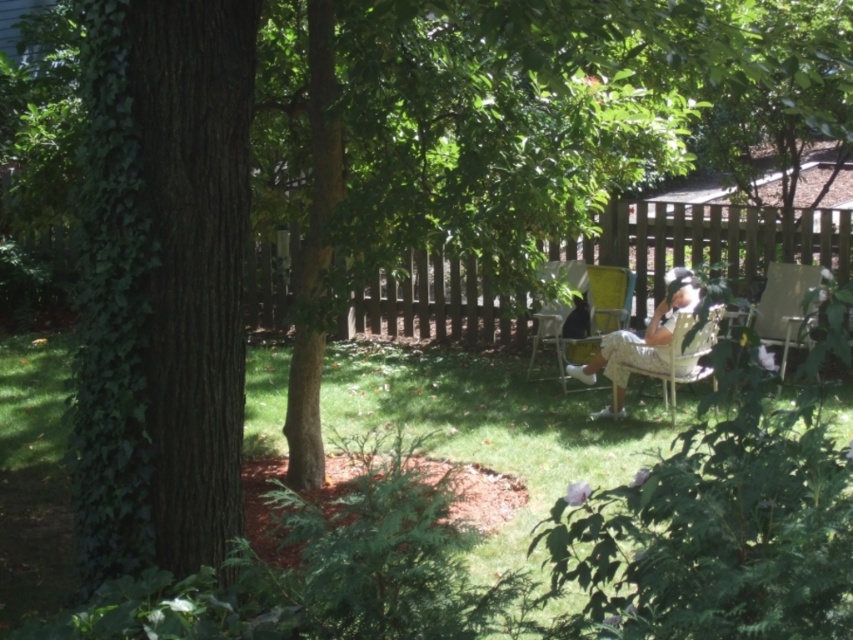
You are standing in the backyard and want to place a small potted plant exactly at the point labeled as point (102, 115). If you are currently 11.66 feet away from this point, how many steps do you need to take to reach it, assuming each step covers approximately 2.5 feet?

Since you are 11.66 feet away from point (102, 115) and each step covers about 2.5 feet, dividing 11.66 by 2.5 gives approximately 4.66 steps. Therefore, you would need to take around 5 steps to reach the point.

You are standing in the backyard and want to place a 30 feet long ladder against the brown wooden fence at center. Can you fit the ladder horizontally without it extending beyond the fence?

The brown wooden fence at center is 30.69 feet away from the viewer. Since the ladder is only 30 feet long, it can be placed horizontally against the fence without extending beyond it as the distance is slightly more than the ladder length.

You are planning to place a new bench in the backyard that is 1 meter wide. You see the brown wooden fence at center and the khaki cotton shorts at center. Which object has enough space to accommodate the bench without overlapping?

The brown wooden fence at center has a width larger than the khaki cotton shorts at center, so the bench can be placed near the brown wooden fence at center as it provides sufficient space.